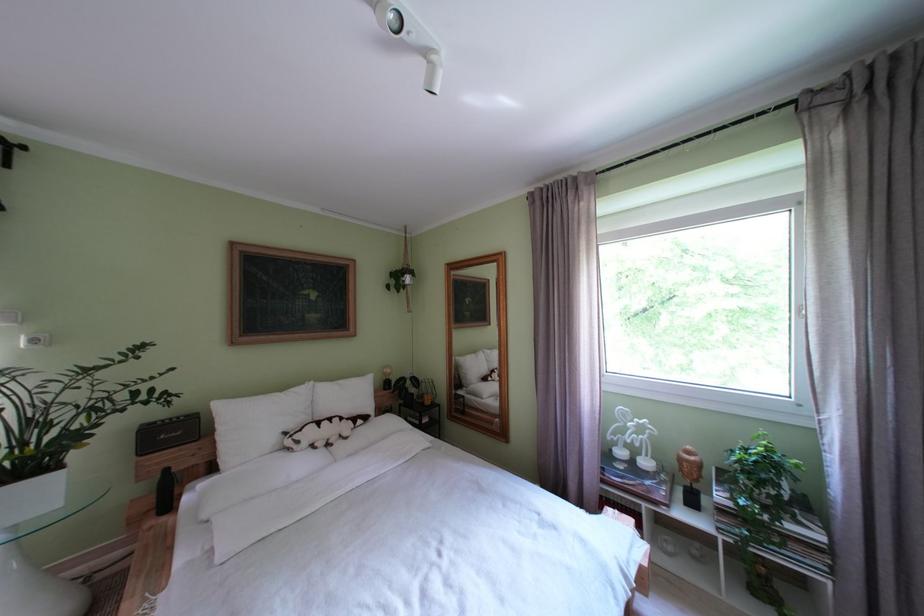
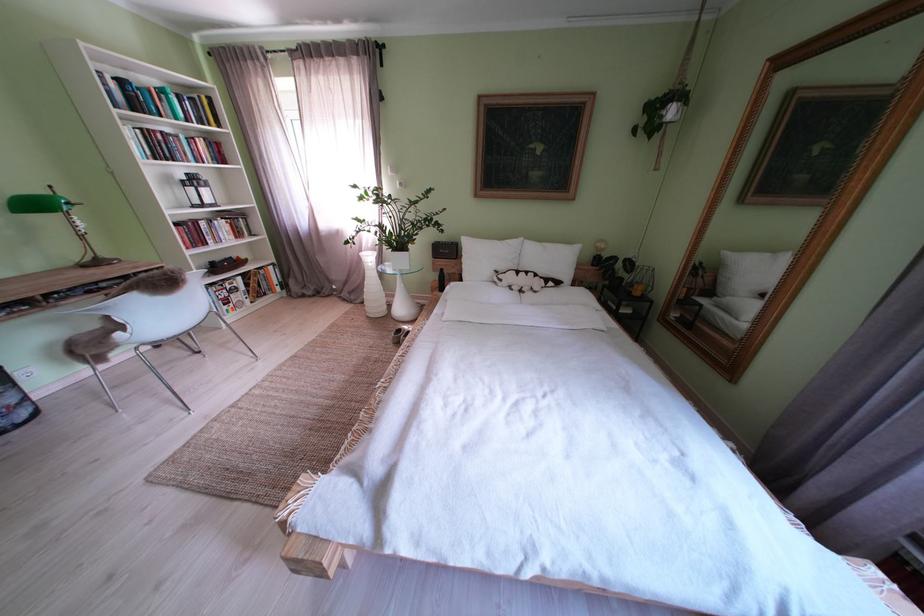
Where in the second image is the point corresponding to the point at 310,447 from the first image?

(512, 285)